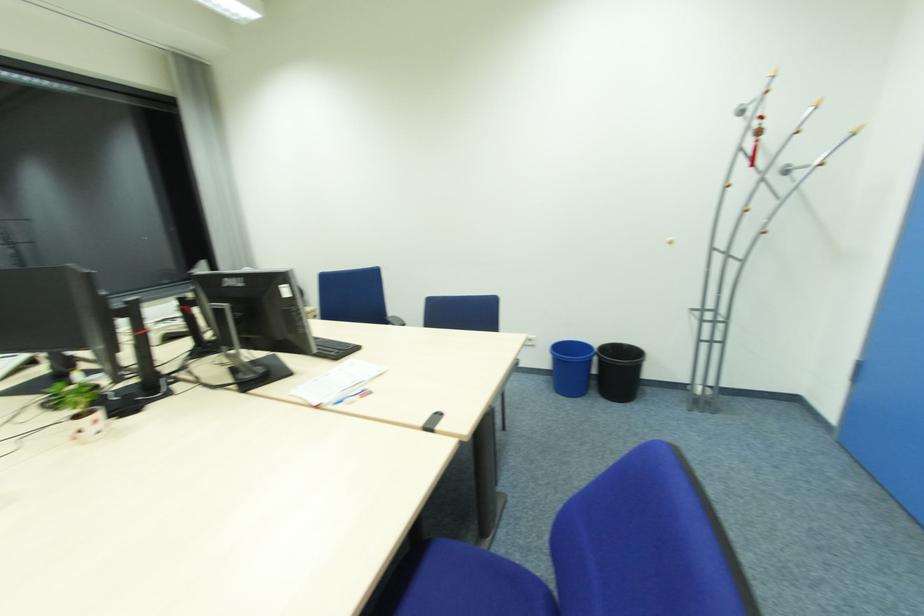
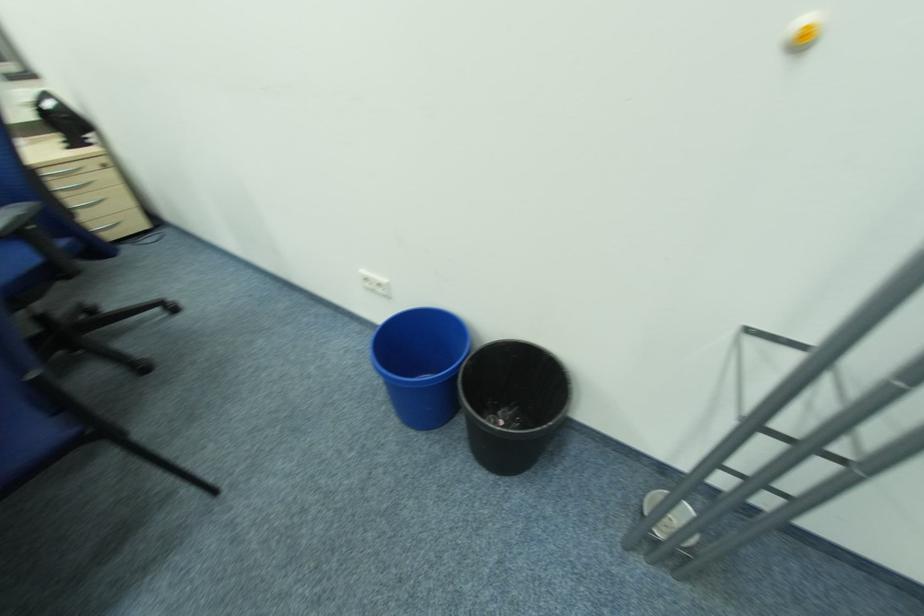
In a continuous first-person perspective shot, in which direction is the camera moving?

The movement direction of the cameraman is right, forward.